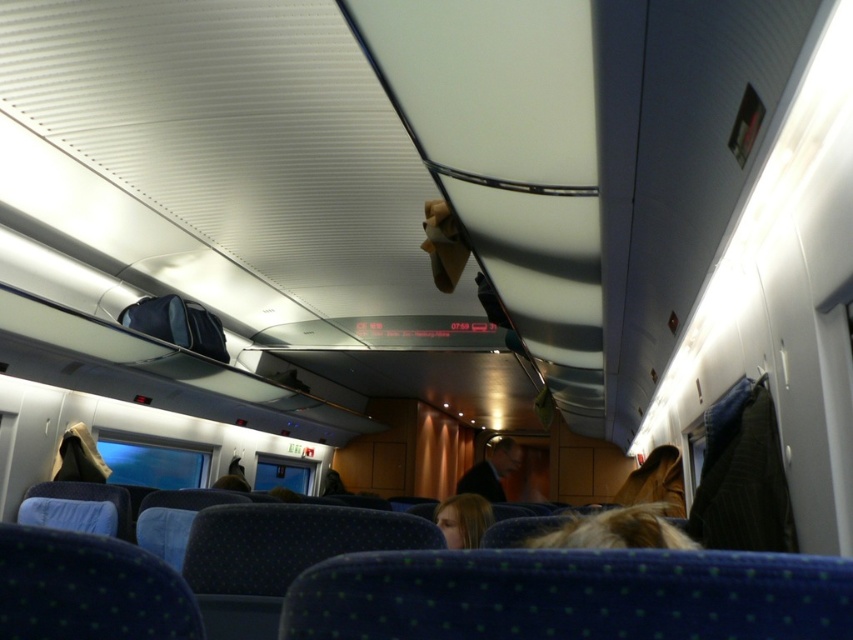
You are a passenger sitting in the train carriage and you want to know if the blonde hair at lower center can fit under the seat in front without touching the dark blue fabric jacket at center. Can you determine this based on their widths?

The blonde hair at lower center is narrower than the dark blue fabric jacket at center, so it should fit under the seat without touching the jacket.

Looking at this image, you are a passenger on the train and want to know if the blonde hair at lower center is larger than the dark blue fabric jacket at center. Can you confirm this?

The blonde hair at lower center is bigger than the dark blue fabric jacket at center, so yes, the blonde hair at lower center is larger than the dark blue fabric jacket at center.

You are a passenger sitting in the train carriage and want to know the exact coordinates of the blonde hair at lower center. What are the coordinates?

The coordinates of the blonde hair at lower center are at point (463, 518).